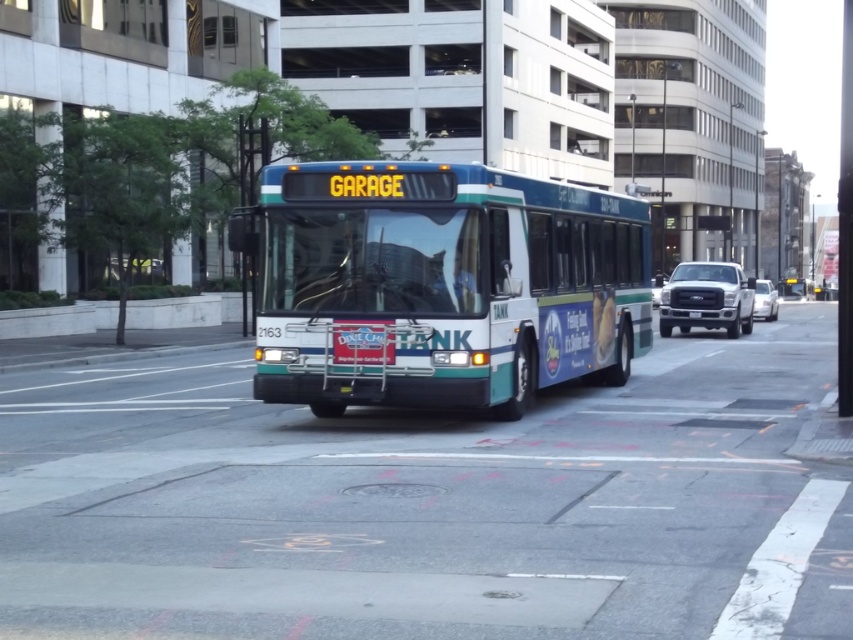
Between white glossy sedan at center and white plastic license plate at center, which one is positioned higher?

white glossy sedan at center

Is white glossy sedan at center to the left of white plastic license plate at center from the viewer's perspective?

In fact, white glossy sedan at center is to the right of white plastic license plate at center.

Measure the distance between point (763,308) and camera.

Point (763,308) and camera are 132.13 feet apart.

Locate an element on the screen. The height and width of the screenshot is (640, 853). white glossy sedan at center is located at coordinates (764, 300).

Does white matte truck at right appear on the right side of white glossy sedan at center?

No, white matte truck at right is not to the right of white glossy sedan at center.

Does white matte truck at right have a greater height compared to white glossy sedan at center?

Yes.

Who is more distant from viewer, (740,304) or (763,280)?

Positioned behind is point (763,280).

What are the coordinates of `white matte truck at right` in the screenshot? It's located at (706, 298).

Between teal glossy bus at center and white glossy sedan at center, which one appears on the right side from the viewer's perspective?

white glossy sedan at center

Between teal glossy bus at center and white glossy sedan at center, which one has more height?

With more height is white glossy sedan at center.

The height and width of the screenshot is (640, 853). In order to click on teal glossy bus at center in this screenshot , I will do `click(440, 285)`.

You are a GUI agent. You are given a task and a screenshot of the screen. Output one action in this format:
    pyautogui.click(x=<x>, y=<y>)
    Task: Click on the teal glossy bus at center
    The width and height of the screenshot is (853, 640).
    Given the screenshot: What is the action you would take?
    pyautogui.click(x=440, y=285)